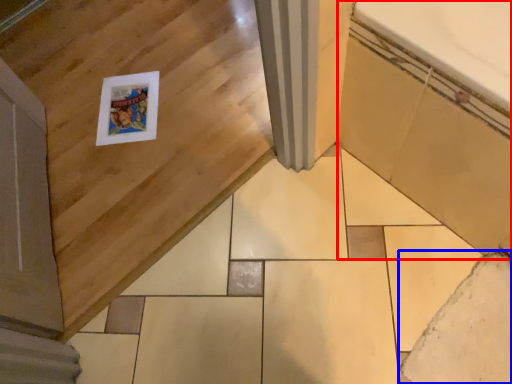
Question: Which object is closer to the camera taking this photo, bath (highlighted by a red box) or ceramic tile (highlighted by a blue box)?

Choices:
 (A) bath
 (B) ceramic tile

Answer: (A)